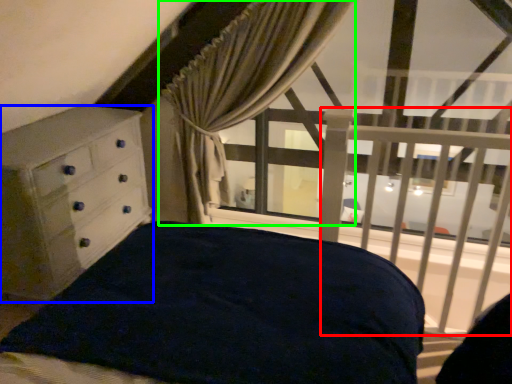
Question: Considering the real-world distances, which object is farthest from balustrade (highlighted by a red box)? chest of drawers (highlighted by a blue box) or curtain (highlighted by a green box)?

Choices:
 (A) chest of drawers
 (B) curtain

Answer: (A)